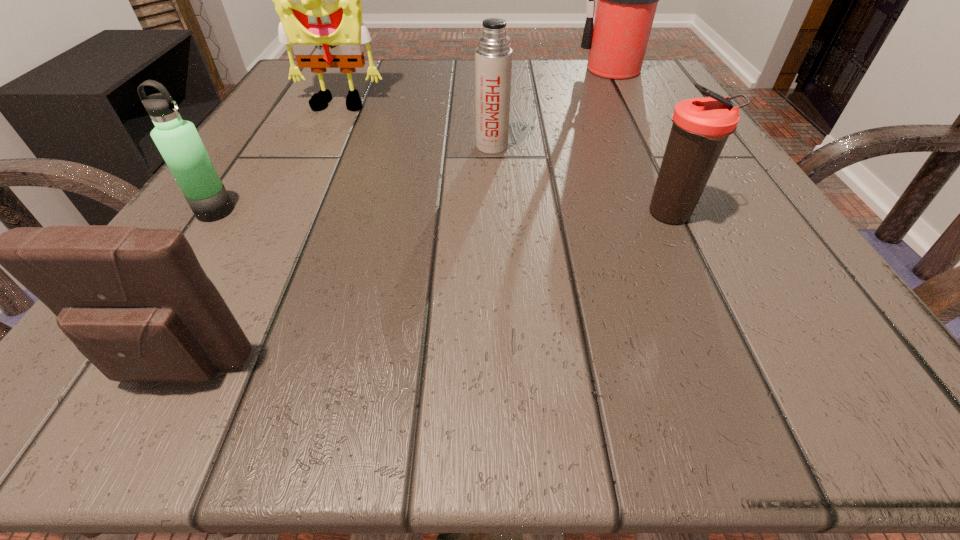
This screenshot has width=960, height=540. I want to click on blank area in the image that satisfies the following two spatial constraints: 1. on the hose direction of the fire extinguisher; 2. on the front side of the second thermos bottle from right to left, so click(x=657, y=146).